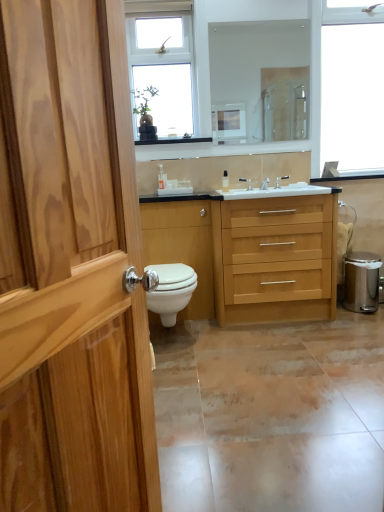
What are the coordinates of `free region under white glossy toilet at center (from a real-world perspective)` in the screenshot? It's located at (174, 340).